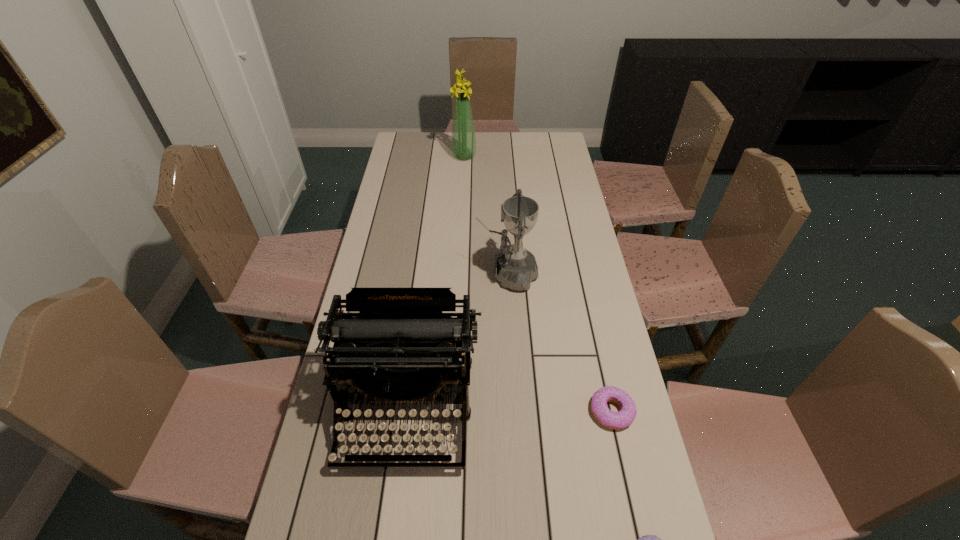
Where is `blank space located 0.110m on the typing side of the typewriter`? Image resolution: width=960 pixels, height=540 pixels. blank space located 0.110m on the typing side of the typewriter is located at coordinates (394, 528).

Identify the location of free spot located 0.050m on the left of the second shortest object. This screenshot has height=540, width=960. (570, 411).

Identify the location of object present at the far edge. This screenshot has height=540, width=960. (463, 141).

Find the location of `object that is at the left edge`. object that is at the left edge is located at coordinates (400, 348).

The height and width of the screenshot is (540, 960). What are the coordinates of `object that is at the right edge` in the screenshot? It's located at (614, 420).

What are the coordinates of `free location at the far edge` in the screenshot? It's located at (483, 154).

You are a GUI agent. You are given a task and a screenshot of the screen. Output one action in this format:
    pyautogui.click(x=<x>, y=<y>)
    Task: Click on the free location at the left edge
    The height and width of the screenshot is (540, 960).
    Given the screenshot: What is the action you would take?
    pyautogui.click(x=424, y=183)

I want to click on free region at the right edge of the desktop, so click(x=622, y=378).

At what (x,y) coordinates should I click in order to perform the action: click on vacant space at the far left corner of the desktop. Please return your answer as a coordinate pair (x, y). Looking at the image, I should click on (x=396, y=152).

Identify the location of vacant area that lies between the award and the taller doughnut. The width and height of the screenshot is (960, 540). (560, 342).